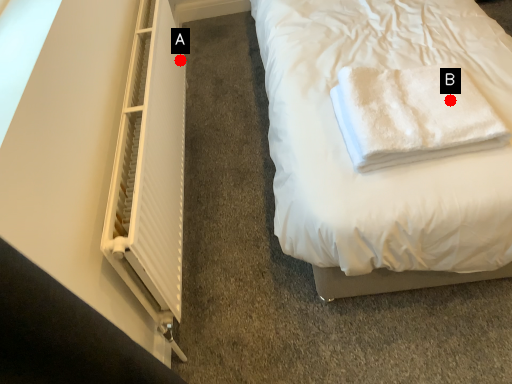
Question: Two points are circled on the image, labeled by A and B beside each circle. Among these points, which one is nearest to the camera?

Choices:
 (A) A is closer
 (B) B is closer

Answer: (B)